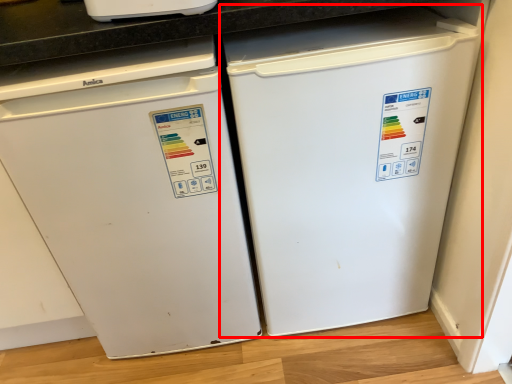
Question: From the image's perspective, where is refrigerator (annotated by the red box) located in relation to home appliance in the image?

Choices:
 (A) below
 (B) above

Answer: (B)